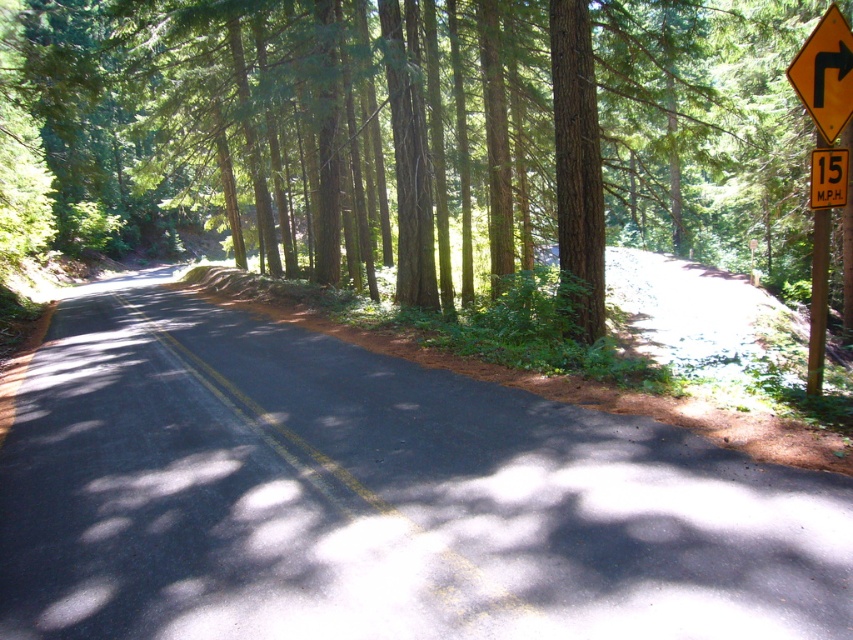
Question: Can you confirm if green smooth tree at center is wider than brown rough bark tree at center?

Choices:
 (A) no
 (B) yes

Answer: (B)

Question: Does brown rough bark tree at center have a greater width compared to yellow plastic sign at upper right?

Choices:
 (A) yes
 (B) no

Answer: (A)

Question: Considering the real-world distances, which object is closest to the yellow signpost at right?

Choices:
 (A) green smooth tree at center
 (B) yellow reflective plastic at right
 (C) yellow plastic sign at upper right
 (D) yellow/yellowish wood sign at right

Answer: (C)

Question: Which of the following is the farthest from the observer?

Choices:
 (A) green smooth tree at center
 (B) yellow reflective plastic at right

Answer: (A)

Question: Does brown rough bark tree at center have a greater width compared to yellow reflective plastic at right?

Choices:
 (A) no
 (B) yes

Answer: (B)

Question: Which object appears closest to the camera in this image?

Choices:
 (A) yellow/yellowish wood sign at right
 (B) yellow signpost at right
 (C) green smooth tree at center

Answer: (A)